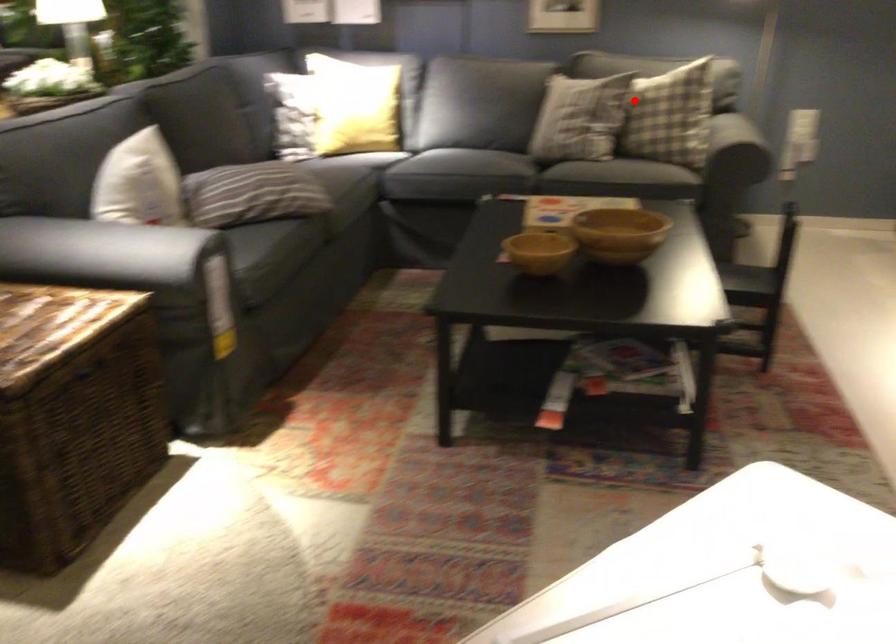
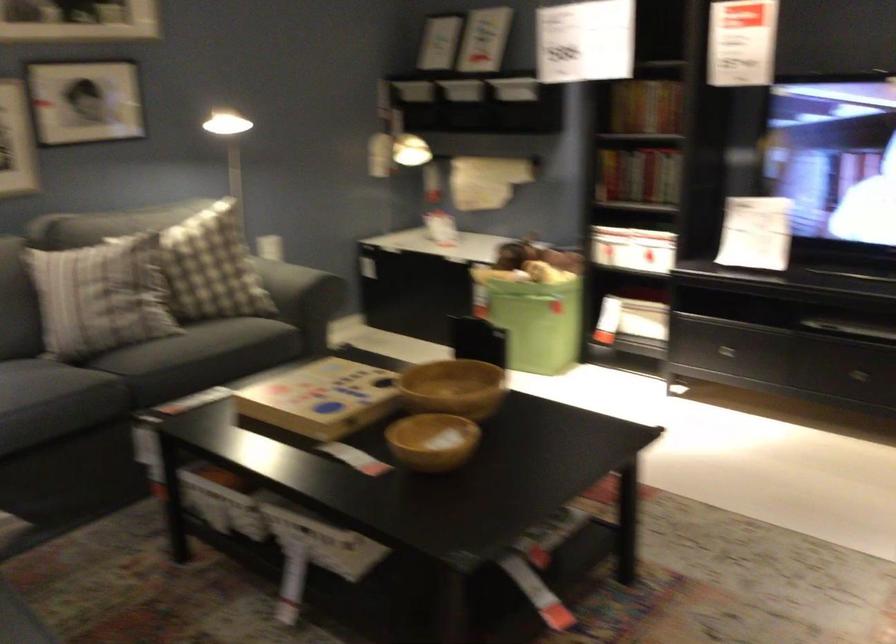
Question: I am providing you with two images of the same scene from different viewpoints. In image1, a red point is highlighted. Considering the same 3D point in image2, which of the following is correct?

Choices:
 (A) It is closer
 (B) It is farther

Answer: (A)